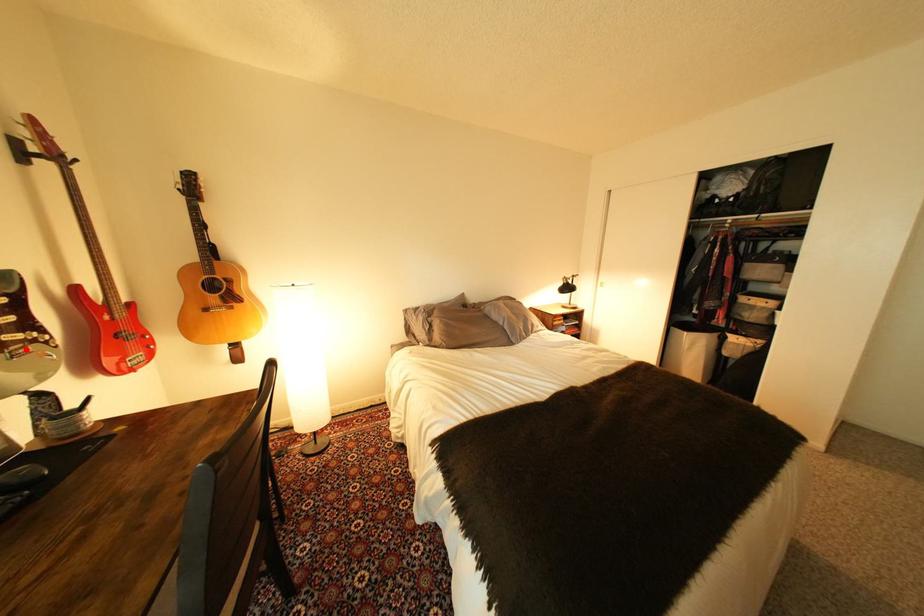
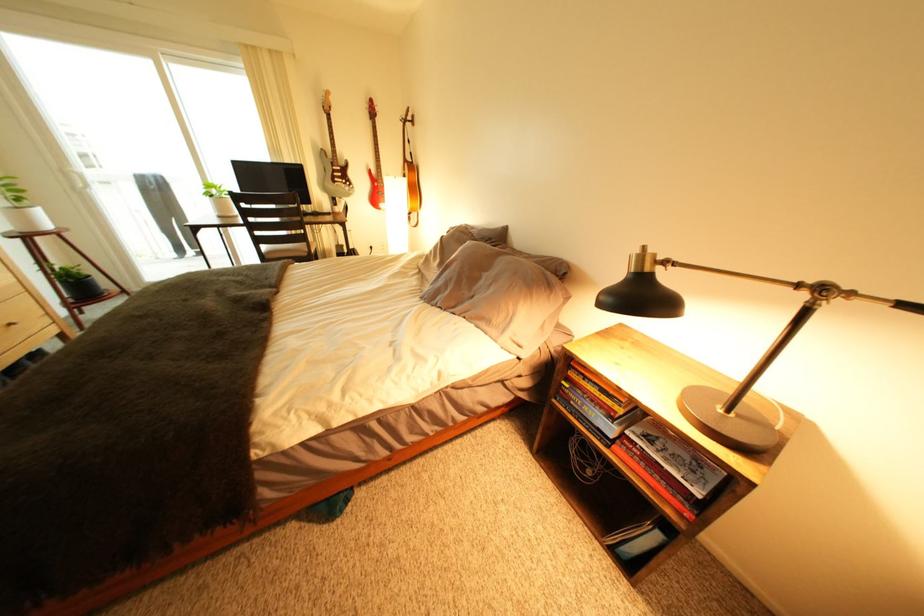
Find the pixel in the second image that matches the highlighted location in the first image.

(349, 185)